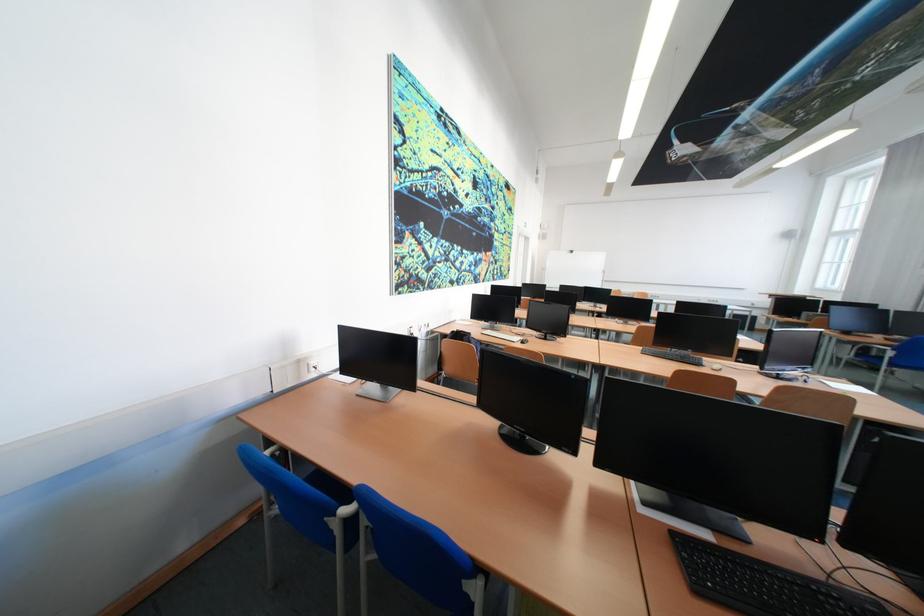
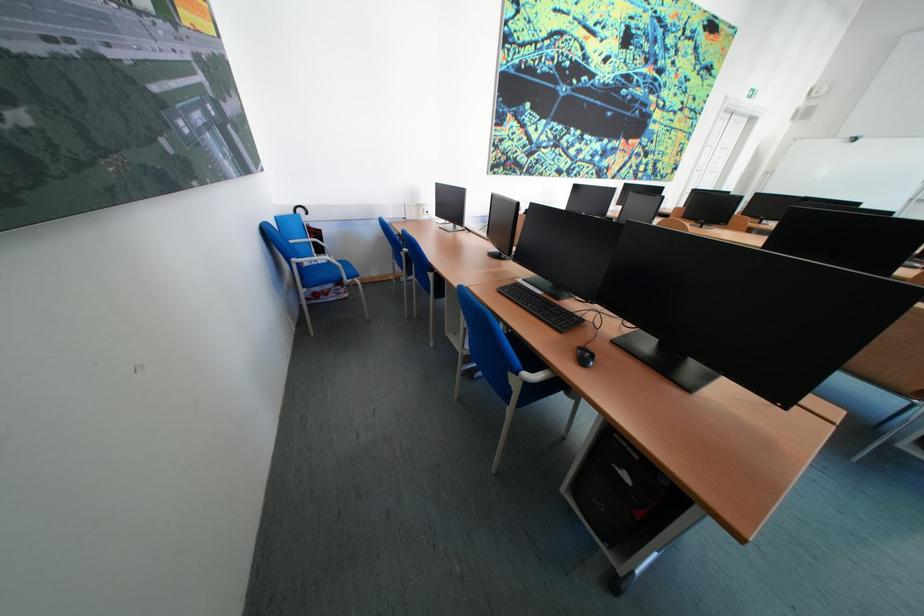
Question: I am providing you with two images of the same scene from different viewpoints. Which of the following objects are not visible in image2?

Choices:
 (A) blue chair armrest
 (B) black computer mouse
 (C) machine handwheel
 (D) blue chair sitting surface

Answer: (B)